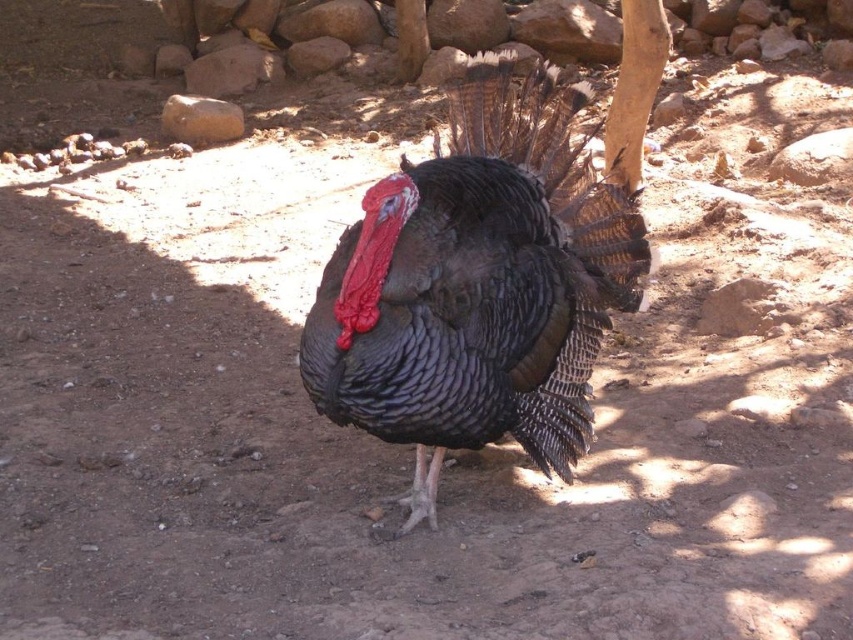
Locate an element on the screen. shiny black turkey at center is located at coordinates (x=479, y=285).

Is shiny black turkey at center smaller than gray rock at center?

No.

Between point (607, 234) and point (277, 54), which one is positioned in front?

Point (607, 234)

Locate an element on the screen. The width and height of the screenshot is (853, 640). shiny black turkey at center is located at coordinates (479, 285).

Which is above, shiny black turkey at center or smooth brown rock at upper center?

smooth brown rock at upper center

Based on the photo, is the position of shiny black turkey at center more distant than that of smooth brown rock at upper center?

No.

Which is in front, point (505, 278) or point (294, 48)?

Point (505, 278) is more forward.

This screenshot has width=853, height=640. What are the coordinates of `shiny black turkey at center` in the screenshot? It's located at (479, 285).

Is point (254, 68) positioned in front of point (318, 52)?

Yes.

Identify the location of gray rock at center. This screenshot has width=853, height=640. (231, 70).